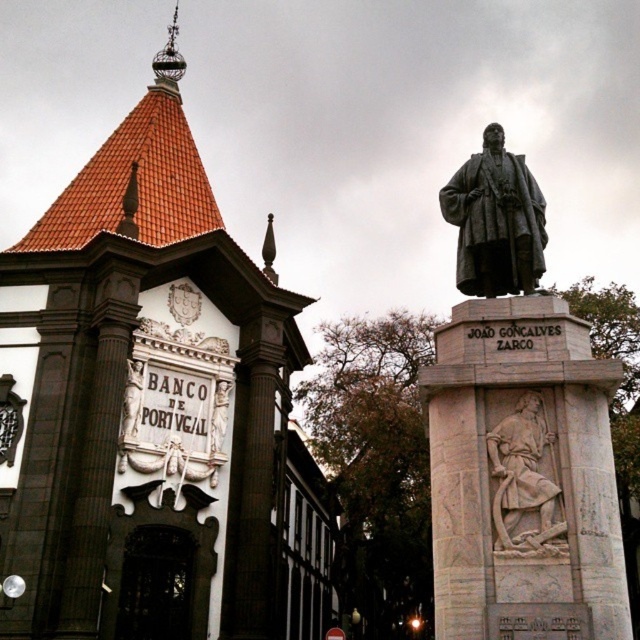
Question: Which object is closer to the camera taking this photo?

Choices:
 (A) gray stone relief at center
 (B) bronze statue at center
 (C) polished bronze statue at center

Answer: (A)

Question: Estimate the real-world distances between objects in this image. Which object is closer to the gray stone relief at center?

Choices:
 (A) bronze statue at center
 (B) polished bronze statue at center

Answer: (A)

Question: Which of these objects is positioned farthest from the polished bronze statue at center?

Choices:
 (A) bronze statue at center
 (B) gray stone relief at center

Answer: (B)

Question: Can you confirm if gray stone relief at center is smaller than polished bronze statue at center?

Choices:
 (A) yes
 (B) no

Answer: (B)

Question: Is bronze statue at center above polished bronze statue at center?

Choices:
 (A) no
 (B) yes

Answer: (B)

Question: Considering the relative positions of gray stone relief at center and polished bronze statue at center in the image provided, where is gray stone relief at center located with respect to polished bronze statue at center?

Choices:
 (A) right
 (B) left

Answer: (A)